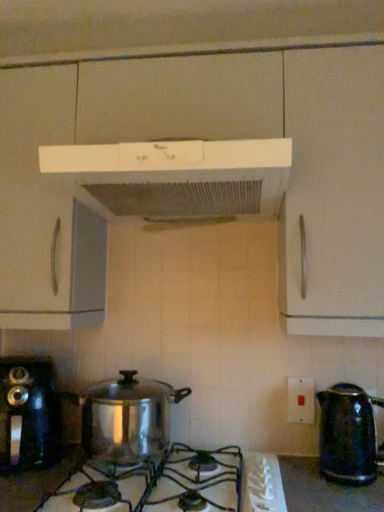
Question: In the image, is white matte range hood at upper center positioned in front of or behind stainless steel pot at center?

Choices:
 (A) front
 (B) behind

Answer: (A)

Question: Does point coord(117,212) appear closer or farther from the camera than point coord(144,380)?

Choices:
 (A) closer
 (B) farther

Answer: (A)

Question: Estimate the real-world distances between objects in this image. Which object is farther from the white matte range hood at upper center?

Choices:
 (A) stainless steel pot at center
 (B) shiny black kettle at right
 (C) white plastic switch at center-right
 (D) shiny metallic gas stove at center
 (E) shiny black coffee maker at left

Answer: (D)

Question: Which of these objects is positioned farthest from the white matte range hood at upper center?

Choices:
 (A) shiny metallic gas stove at center
 (B) stainless steel pot at center
 (C) white plastic switch at center-right
 (D) shiny black coffee maker at left
 (E) shiny black kettle at right

Answer: (A)